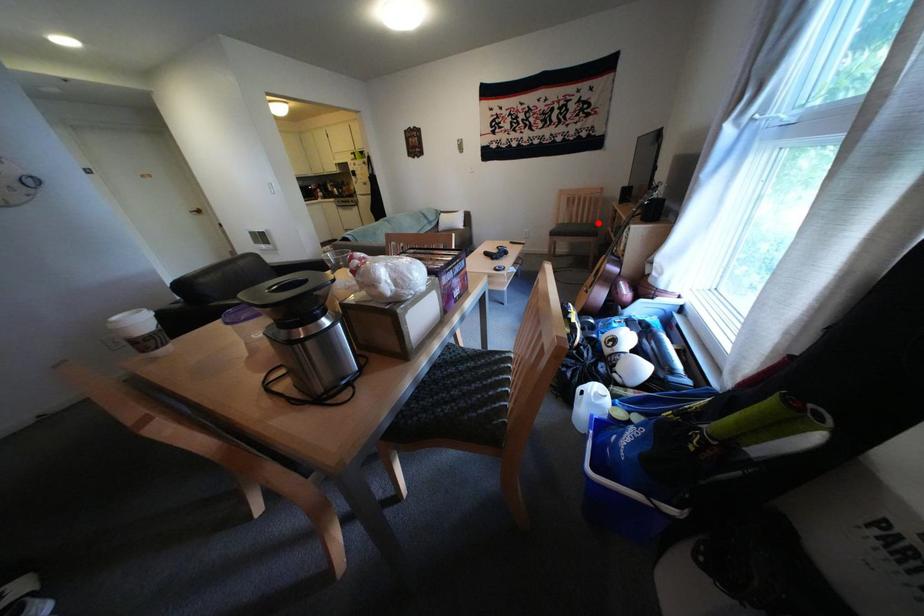
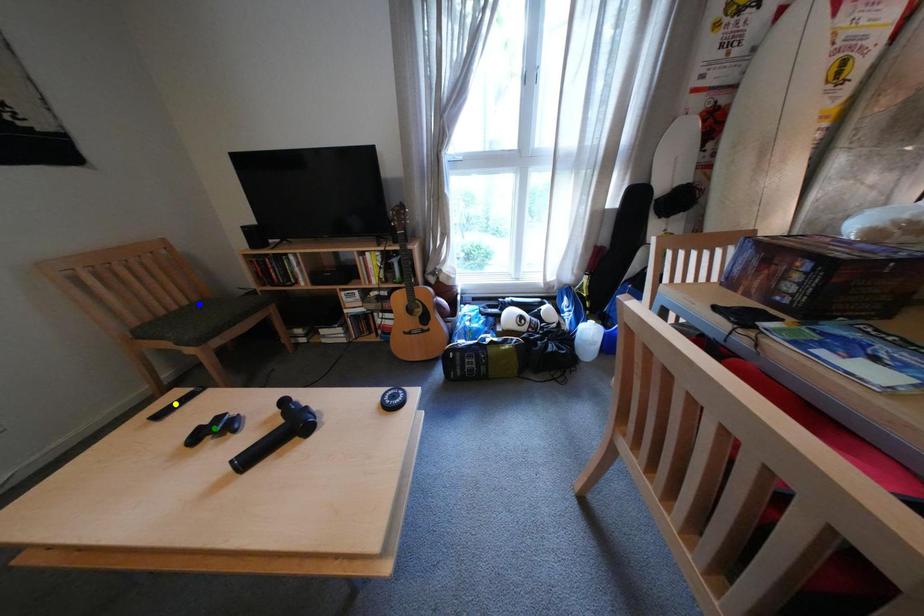
Question: I am providing you with two images of the same scene from different viewpoints. A red point is marked on the first image. You are given multiple points on the second image. Which point in image 2 is actually the same real-world point as the red point in image 1?

Choices:
 (A) blue point
 (B) green point
 (C) yellow point

Answer: (A)